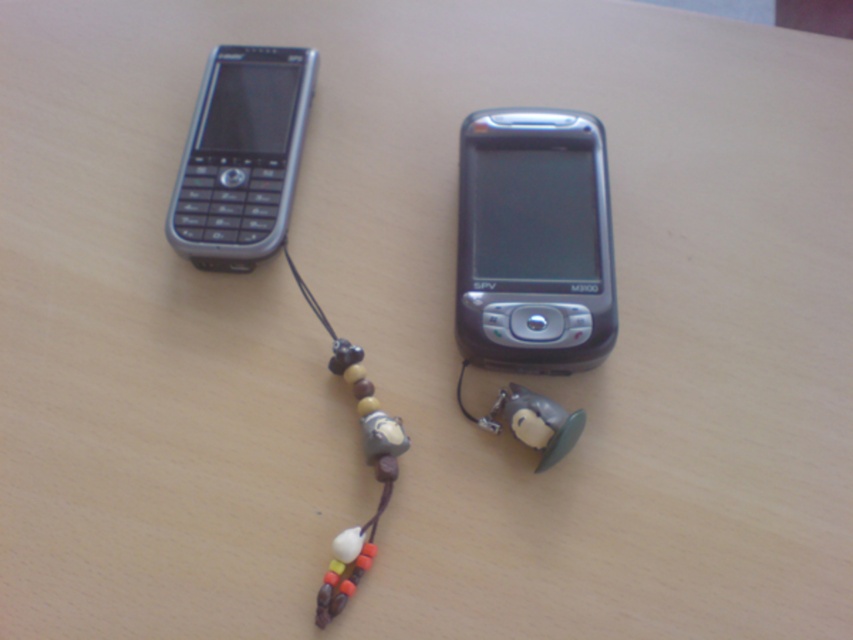
Is point (491, 218) farther from camera compared to point (231, 248)?

Yes, point (491, 218) is behind point (231, 248).

This screenshot has height=640, width=853. Identify the location of slate gray plastic smartphone at center. (534, 243).

In order to click on slate gray plastic smartphone at center in this screenshot , I will do `click(534, 243)`.

From the picture: Who is more forward, (x=219, y=260) or (x=399, y=436)?

Point (x=399, y=436) is in front.

Does silver metallic phone at upper left appear on the right side of multicolored beaded string at center?

Incorrect, silver metallic phone at upper left is not on the right side of multicolored beaded string at center.

Between point (280, 90) and point (343, 356), which one is positioned behind?

Positioned behind is point (280, 90).

Where is `silver metallic phone at upper left`? Image resolution: width=853 pixels, height=640 pixels. silver metallic phone at upper left is located at coordinates (241, 156).

In the scene shown: Measure the distance between slate gray plastic smartphone at center and multicolored beaded string at center.

10.93 inches

Which is more to the right, slate gray plastic smartphone at center or multicolored beaded string at center?

slate gray plastic smartphone at center

The height and width of the screenshot is (640, 853). What do you see at coordinates (534, 243) in the screenshot?
I see `slate gray plastic smartphone at center` at bounding box center [534, 243].

Where is `slate gray plastic smartphone at center`? slate gray plastic smartphone at center is located at coordinates (534, 243).